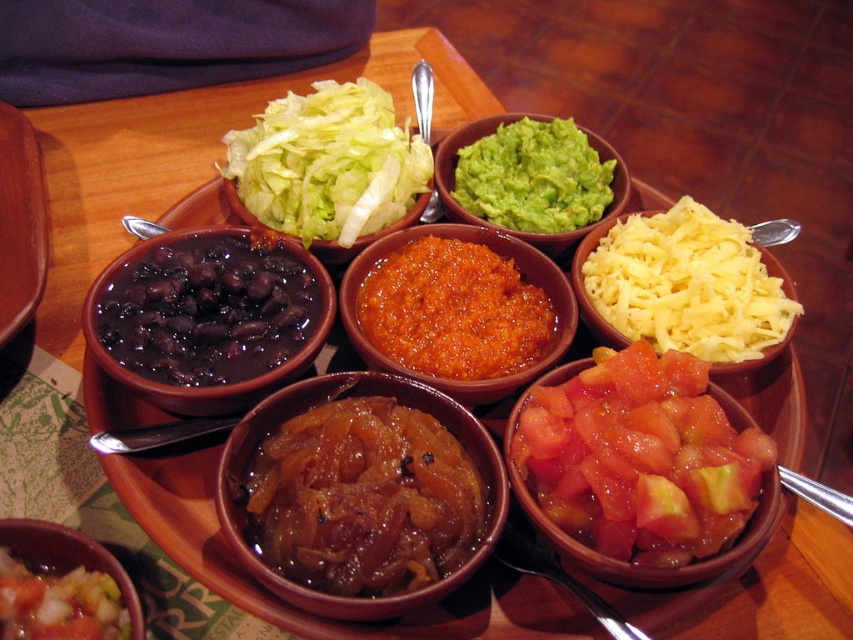
Question: Which point is farther to the camera?

Choices:
 (A) (192, 250)
 (B) (772, 484)

Answer: (A)

Question: Does shiny brown bowl at center have a smaller size compared to orange textured salsa at center?

Choices:
 (A) no
 (B) yes

Answer: (B)

Question: Which object appears farthest from the camera in this image?

Choices:
 (A) matte brown bowl at lower left
 (B) tomato salsa at center
 (C) shiny brown bowl at center
 (D) yellow shredded cheese at center right

Answer: (D)

Question: From the image, what is the correct spatial relationship of matte black beans at left in relation to orange textured salsa at center?

Choices:
 (A) above
 (B) below

Answer: (B)

Question: Among these points, which one is farthest from the camera?

Choices:
 (A) (532, 124)
 (B) (170, 365)

Answer: (A)

Question: Can you confirm if shiny brown bowl at center is positioned to the left of green smooth guacamole at center right?

Choices:
 (A) no
 (B) yes

Answer: (B)